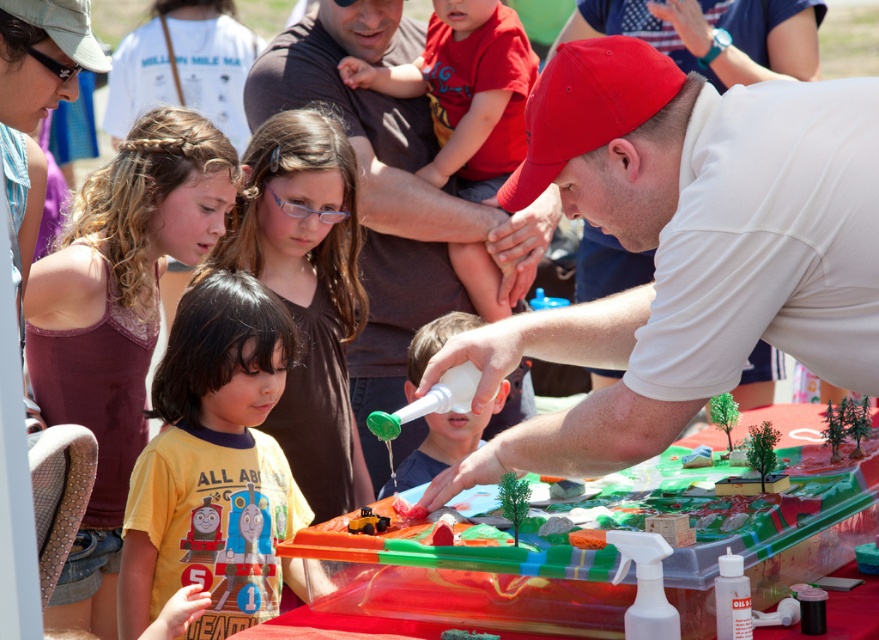
Based on the photo, is white matte bottle at center to the left of smooth plastic bottle at center from the viewer's perspective?

Indeed, white matte bottle at center is positioned on the left side of smooth plastic bottle at center.

Is white matte bottle at center bigger than smooth plastic bottle at center?

Indeed, white matte bottle at center has a larger size compared to smooth plastic bottle at center.

The height and width of the screenshot is (640, 879). What are the coordinates of `white matte bottle at center` in the screenshot? It's located at (384, 189).

Can you confirm if yellow matte shirt at lower left is positioned to the left of smooth plastic bottle at center?

Yes, yellow matte shirt at lower left is to the left of smooth plastic bottle at center.

Can you confirm if yellow matte shirt at lower left is positioned to the right of smooth plastic bottle at center?

Incorrect, yellow matte shirt at lower left is not on the right side of smooth plastic bottle at center.

Does point (178, 518) come behind point (415, 355)?

No, (178, 518) is in front of (415, 355).

This screenshot has width=879, height=640. I want to click on yellow matte shirt at lower left, so click(212, 461).

Does white matte bottle at center appear over red cotton shirt at upper center?

No, white matte bottle at center is not above red cotton shirt at upper center.

Is the position of white matte bottle at center less distant than that of red cotton shirt at upper center?

That is True.

Locate an element on the screen. This screenshot has height=640, width=879. white matte bottle at center is located at coordinates (384, 189).